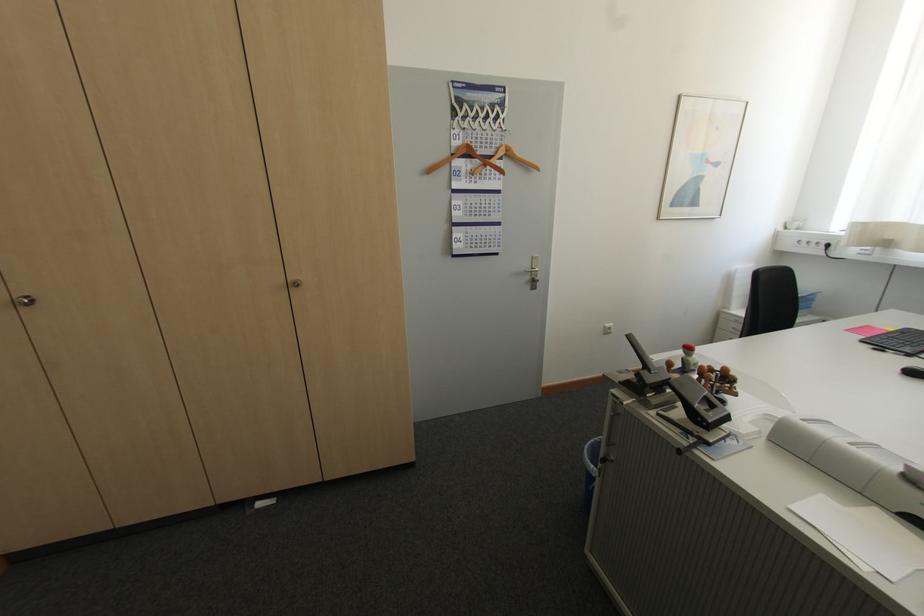
Find where to pull the silver door handle. Please return your answer as a coordinate pair (x, y).

(533, 272)